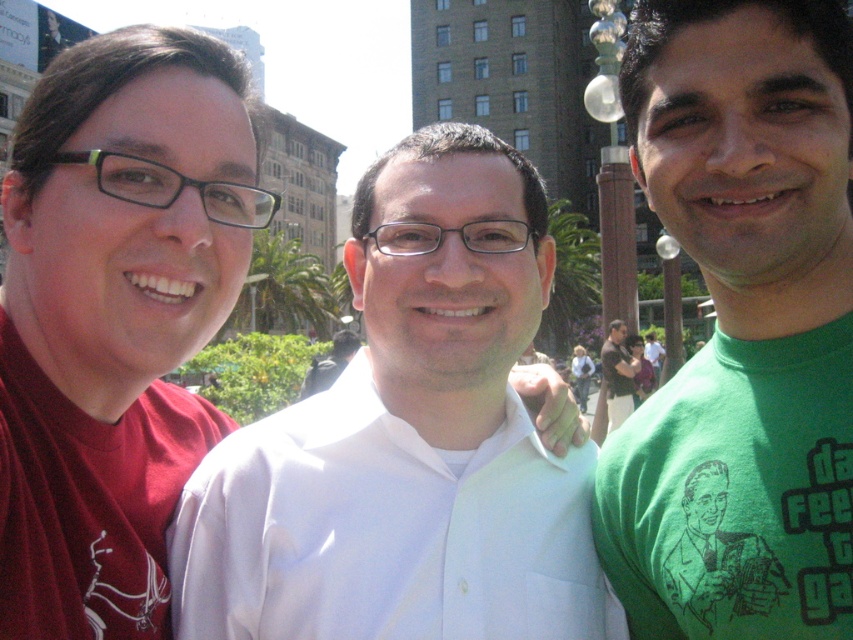
This screenshot has width=853, height=640. What do you see at coordinates (109, 328) in the screenshot? I see `matte red shirt at left` at bounding box center [109, 328].

Between point (86, 202) and point (575, 376), which one is positioned in front?

Point (86, 202) is in front.

Where is `matte red shirt at left`? matte red shirt at left is located at coordinates 109,328.

Is point (573, 605) positioned before point (581, 406)?

Yes, it is in front of point (581, 406).

Is white cotton shirt at center thinner than blonde hair at center?

In fact, white cotton shirt at center might be wider than blonde hair at center.

Where is `white cotton shirt at center`? The height and width of the screenshot is (640, 853). white cotton shirt at center is located at coordinates (386, 531).

Find the location of a particular element. Image resolution: width=853 pixels, height=640 pixels. white cotton shirt at center is located at coordinates (386, 531).

Does white cotton shirt at center have a smaller size compared to matte brown hair at center?

No.

Between white cotton shirt at center and matte brown hair at center, which one appears on the left side from the viewer's perspective?

From the viewer's perspective, white cotton shirt at center appears more on the left side.

Is point (306, 577) in front of point (596, 413)?

Yes, point (306, 577) is in front of point (596, 413).

Where is `white cotton shirt at center`? This screenshot has height=640, width=853. white cotton shirt at center is located at coordinates (386, 531).